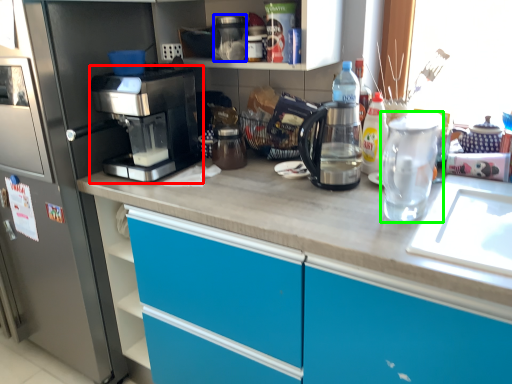
Question: Which is nearer to the coffee maker (highlighted by a red box)? appliance (highlighted by a blue box) or tea pot (highlighted by a green box).

Choices:
 (A) appliance
 (B) tea pot

Answer: (A)